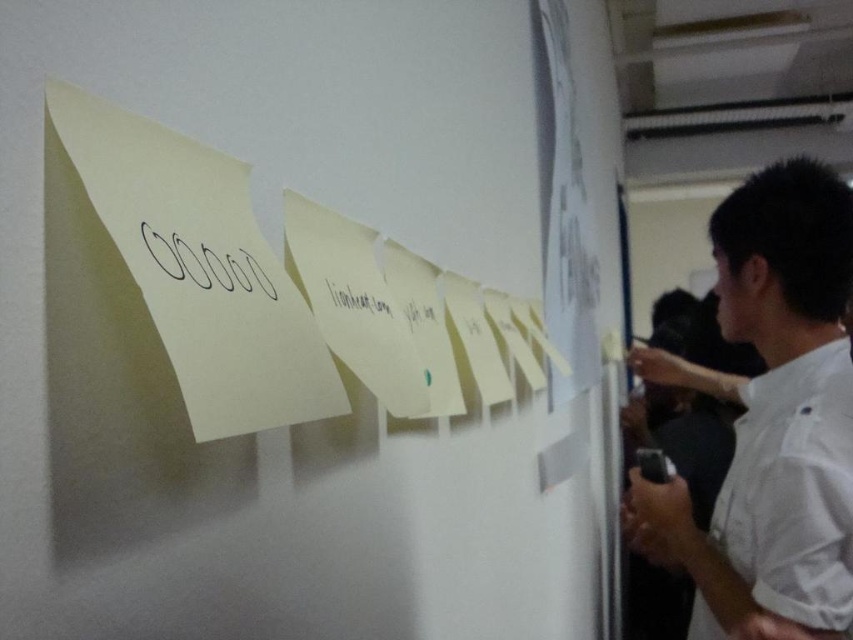
Question: Estimate the real-world distances between objects in this image. Which object is farther from the black paper at center?

Choices:
 (A) yellow paper notes at upper center
 (B) black ink circles at upper center
 (C) white shirt at right

Answer: (C)

Question: Can you confirm if white shirt at right is positioned above black paper at center?

Choices:
 (A) yes
 (B) no

Answer: (B)

Question: Can you confirm if white shirt at right is positioned to the left of black paper at center?

Choices:
 (A) no
 (B) yes

Answer: (A)

Question: Is yellow paper notes at upper center smaller than white shirt at right?

Choices:
 (A) no
 (B) yes

Answer: (A)

Question: Which point is farther to the camera?

Choices:
 (A) yellow paper notes at upper center
 (B) black paper at center
 (C) white shirt at right
 (D) black ink circles at upper center

Answer: (C)

Question: Which object is closer to the camera taking this photo?

Choices:
 (A) black ink circles at upper center
 (B) yellow paper notes at upper center
 (C) white shirt at right

Answer: (B)